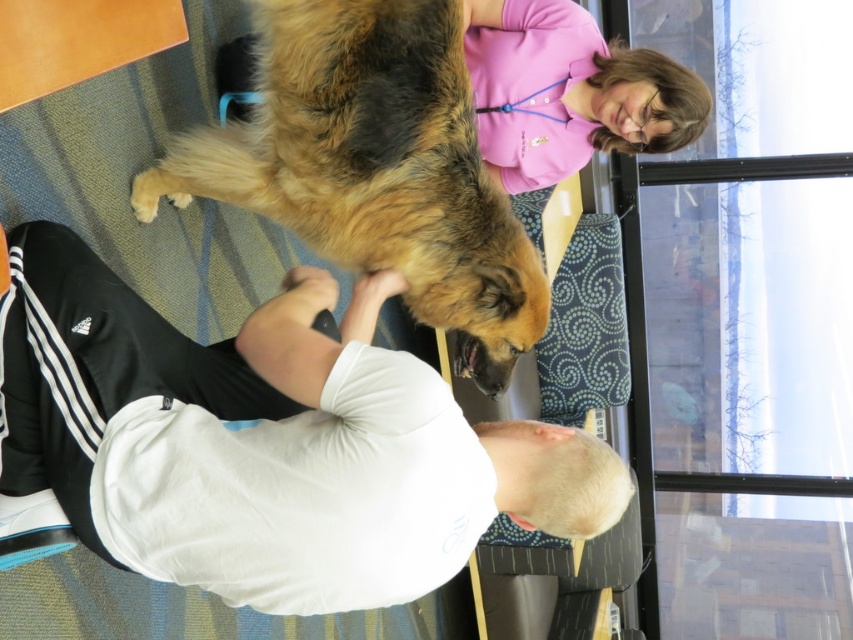
You are a photographer capturing the scene. You need to focus on the white cotton shirt at upper center and the golden fur dog at center. Which object is located to the left of the other?

The white cotton shirt at upper center is positioned on the left side of golden fur dog at center.

You are a photographer standing at the camera position. You want to capture a closeup shot of the white cotton shirt at upper center. Considering your current position, do you need to move closer or farther away to get a better closeup?

The white cotton shirt at upper center is 4.27 feet from the camera. To get a closer shot, you need to move closer to reduce the distance between the camera and the white cotton shirt at upper center.